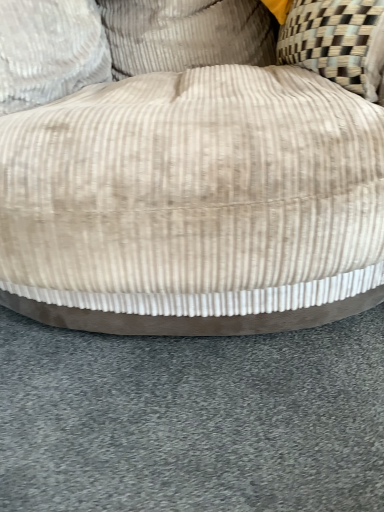
Question: Is beige corduroy pillow at upper center, positioned as the 1th pillow in right-to-left order, facing away from beige corduroy pillow at upper left, marked as the 1th pillow in a left-to-right arrangement?

Choices:
 (A) yes
 (B) no

Answer: (B)

Question: Can you confirm if beige corduroy pillow at upper center, positioned as the 1th pillow in right-to-left order, is positioned to the left of beige corduroy pillow at upper left, marked as the 1th pillow in a left-to-right arrangement?

Choices:
 (A) yes
 (B) no

Answer: (B)

Question: Is beige corduroy pillow at upper center, the 2th pillow from the left, with beige corduroy pillow at upper left, the 2th pillow from the right?

Choices:
 (A) no
 (B) yes

Answer: (A)

Question: Is beige corduroy pillow at upper center, positioned as the 1th pillow in right-to-left order, smaller than beige corduroy pillow at upper left, the 2th pillow from the right?

Choices:
 (A) no
 (B) yes

Answer: (A)

Question: Is beige corduroy pillow at upper center, positioned as the 1th pillow in right-to-left order, aimed at beige corduroy pillow at upper left, marked as the 1th pillow in a left-to-right arrangement?

Choices:
 (A) no
 (B) yes

Answer: (B)

Question: Does beige corduroy pillow at upper center, positioned as the 1th pillow in right-to-left order, lie in front of beige corduroy pillow at upper left, marked as the 1th pillow in a left-to-right arrangement?

Choices:
 (A) yes
 (B) no

Answer: (B)

Question: Is beige corduroy ottoman at center smaller than beige corduroy pillow at upper left, marked as the 1th pillow in a left-to-right arrangement?

Choices:
 (A) no
 (B) yes

Answer: (A)

Question: Is beige corduroy ottoman at center positioned in front of beige corduroy pillow at upper left, marked as the 1th pillow in a left-to-right arrangement?

Choices:
 (A) yes
 (B) no

Answer: (A)

Question: Is beige corduroy ottoman at center to the right of beige corduroy pillow at upper left, marked as the 1th pillow in a left-to-right arrangement, from the viewer's perspective?

Choices:
 (A) no
 (B) yes

Answer: (B)

Question: Is beige corduroy ottoman at center located outside beige corduroy pillow at upper left, the 2th pillow from the right?

Choices:
 (A) yes
 (B) no

Answer: (A)

Question: Considering the relative sizes of beige corduroy ottoman at center and beige corduroy pillow at upper left, the 2th pillow from the right, in the image provided, is beige corduroy ottoman at center bigger than beige corduroy pillow at upper left, the 2th pillow from the right,?

Choices:
 (A) yes
 (B) no

Answer: (A)

Question: Is beige corduroy pillow at upper left, the 2th pillow from the right, inside beige corduroy ottoman at center?

Choices:
 (A) no
 (B) yes

Answer: (B)

Question: Can you confirm if beige corduroy pillow at upper center, positioned as the 1th pillow in right-to-left order, is taller than beige corduroy ottoman at center?

Choices:
 (A) yes
 (B) no

Answer: (B)